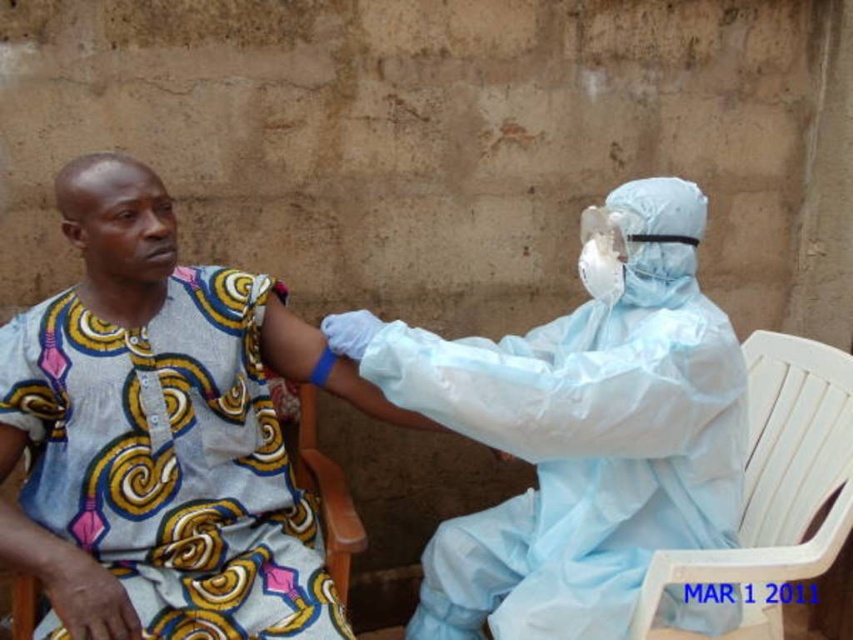
Question: Which of the following is the closest to the observer?

Choices:
 (A) (18, 618)
 (B) (814, 422)
 (C) (625, 305)

Answer: (A)

Question: Can you confirm if light blue protective suit at center is positioned to the right of white plastic chair at right?

Choices:
 (A) yes
 (B) no

Answer: (B)

Question: Estimate the real-world distances between objects in this image. Which object is closer to the wooden chair at lower center?

Choices:
 (A) light blue protective suit at center
 (B) white plastic chair at right

Answer: (A)

Question: Estimate the real-world distances between objects in this image. Which object is farther from the white plastic chair at right?

Choices:
 (A) wooden chair at lower center
 (B) light blue protective suit at center

Answer: (A)

Question: Does white plastic chair at right have a lesser width compared to wooden chair at lower center?

Choices:
 (A) no
 (B) yes

Answer: (A)

Question: Observing the image, what is the correct spatial positioning of light blue protective suit at center in reference to white plastic chair at right?

Choices:
 (A) right
 (B) left

Answer: (B)